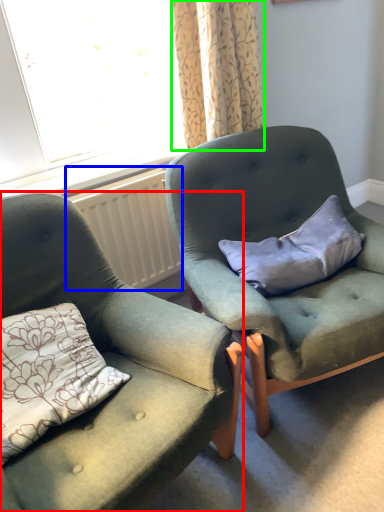
Question: Which is nearer to the chair (highlighted by a red box)? radiator (highlighted by a blue box) or curtain (highlighted by a green box).

Choices:
 (A) radiator
 (B) curtain

Answer: (A)